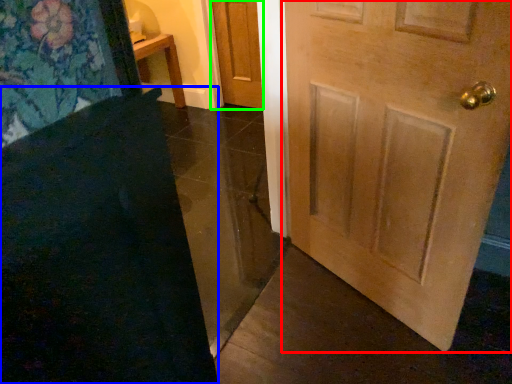
Question: Which object is the closest to the door (highlighted by a red box)? Choose among these: doormat (highlighted by a blue box) or door (highlighted by a green box).

Choices:
 (A) doormat
 (B) door

Answer: (A)